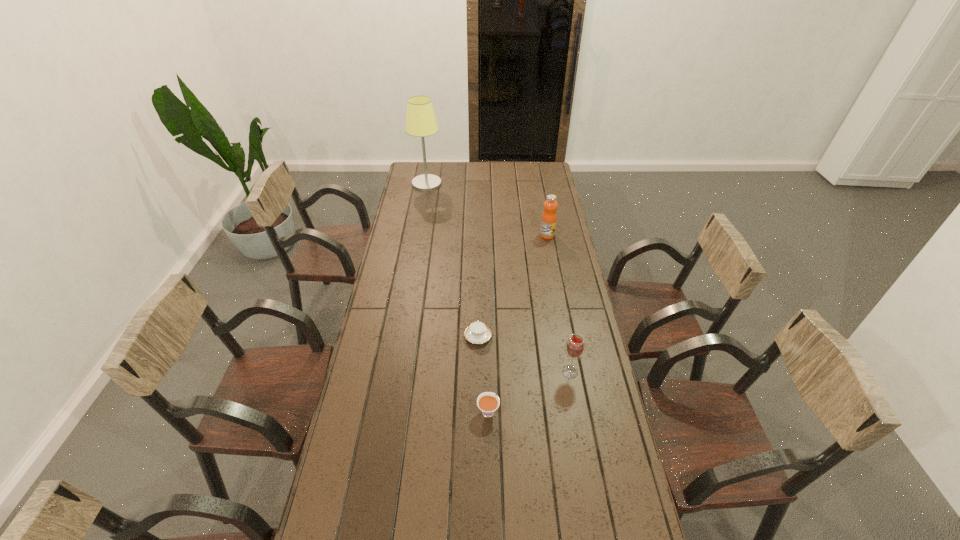
Locate an element on the screen. Image resolution: width=960 pixels, height=540 pixels. the tallest object is located at coordinates (421, 121).

Where is `the farthest object`? Image resolution: width=960 pixels, height=540 pixels. the farthest object is located at coordinates (421, 121).

This screenshot has width=960, height=540. I want to click on the second tallest object, so click(548, 224).

Where is `the second farthest object`? the second farthest object is located at coordinates (548, 224).

Locate an element on the screen. the second nearest object is located at coordinates (575, 346).

Identify the location of wineglass. This screenshot has width=960, height=540. [575, 346].

The image size is (960, 540). In order to click on the fourth tallest object in this screenshot , I will do tap(487, 402).

Where is `the nearest object`? The width and height of the screenshot is (960, 540). the nearest object is located at coordinates (487, 402).

Where is `the shortest object`? the shortest object is located at coordinates (477, 333).

The height and width of the screenshot is (540, 960). I want to click on the shorter teacup, so click(477, 333).